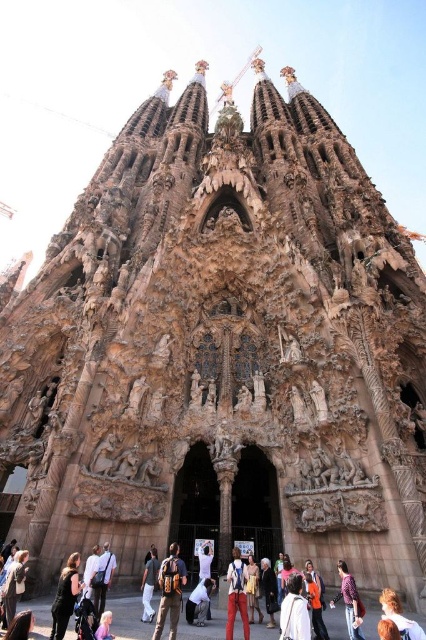
Based on the photo, can you confirm if white fabric bag at lower center is bigger than denim pants at lower center?

No, white fabric bag at lower center is not bigger than denim pants at lower center.

Which is behind, point (284, 611) or point (227, 580)?

Positioned behind is point (227, 580).

Does point (307, 616) come in front of point (230, 586)?

Yes.

This screenshot has height=640, width=426. Identify the location of white fabric bag at lower center. pos(293,611).

Who is lower down, plaid shirt at center or denim jacket at lower center?

denim jacket at lower center is lower down.

Does plaid shirt at center have a smaller size compared to denim jacket at lower center?

Actually, plaid shirt at center might be larger than denim jacket at lower center.

Does point (362, 609) come farther from viewer compared to point (256, 593)?

No, (362, 609) is closer to viewer.

The image size is (426, 640). I want to click on plaid shirt at center, so click(348, 602).

Is point (230, 600) positioned behind point (273, 604)?

No, (230, 600) is in front of (273, 604).

Between denim pants at lower center and dark blue denim jacket at center, which one is positioned higher?

denim pants at lower center is above.

This screenshot has width=426, height=640. Identify the location of denim pants at lower center. (236, 595).